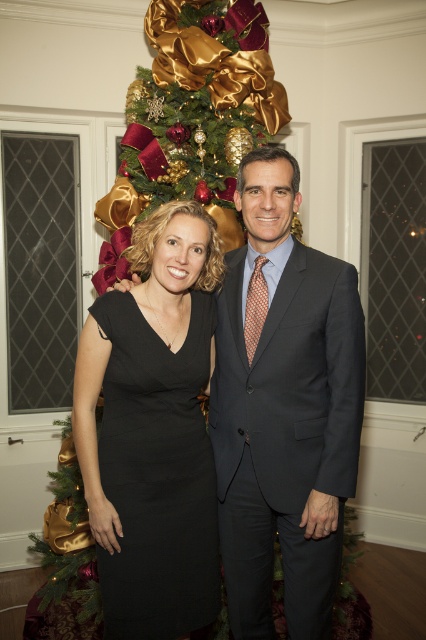
Which is in front, point (276, 292) or point (117, 557)?

Point (117, 557) is in front.

Can you confirm if dark gray suit at center is positioned to the right of black satin dress at center?

Yes, dark gray suit at center is to the right of black satin dress at center.

In order to click on dark gray suit at center in this screenshot , I will do `click(285, 436)`.

Which is behind, point (330, 364) or point (253, 120)?

Positioned behind is point (253, 120).

Who is taller, dark gray suit at center or shiny gold ornaments at center?

With more height is shiny gold ornaments at center.

Identify the location of dark gray suit at center. (285, 436).

Does black satin dress at center have a lesser height compared to shiny gold ornaments at center?

Yes.

This screenshot has height=640, width=426. I want to click on black satin dress at center, so click(157, 474).